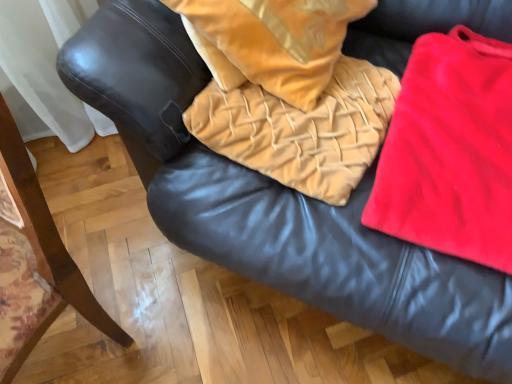
Locate an element on the screen. The width and height of the screenshot is (512, 384). velvet tan blanket at center is located at coordinates (302, 129).

What do you see at coordinates (35, 261) in the screenshot? I see `matte black armrest at left` at bounding box center [35, 261].

What do you see at coordinates (271, 42) in the screenshot? The height and width of the screenshot is (384, 512). I see `velvet tan pillow at center` at bounding box center [271, 42].

Describe the element at coordinates (450, 151) in the screenshot. This screenshot has height=384, width=512. I see `red velvet cloth at right` at that location.

Image resolution: width=512 pixels, height=384 pixels. In order to click on velvet tan blanket at center in this screenshot , I will do `click(302, 129)`.

Considering their positions, is velvet tan blanket at center located in front of or behind red velvet cloth at right?

In the image, velvet tan blanket at center appears behind red velvet cloth at right.

Considering the relative sizes of velvet tan blanket at center and red velvet cloth at right in the image provided, is velvet tan blanket at center thinner than red velvet cloth at right?

Yes.

Can you confirm if velvet tan blanket at center is smaller than red velvet cloth at right?

No, velvet tan blanket at center is not smaller than red velvet cloth at right.

How different are the orientations of velvet tan blanket at center and red velvet cloth at right in degrees?

2.83 degrees.

Can you tell me how much red velvet cloth at right and matte black armrest at left differ in facing direction?

There is a 8.31-degree angle between the facing directions of red velvet cloth at right and matte black armrest at left.

From the image's perspective, between red velvet cloth at right and matte black armrest at left, which one is located above?

red velvet cloth at right appears higher in the image.

Can you confirm if red velvet cloth at right is shorter than matte black armrest at left?

Correct, red velvet cloth at right is not as tall as matte black armrest at left.

Does red velvet cloth at right turn towards matte black armrest at left?

No, red velvet cloth at right is not aimed at matte black armrest at left.

Considering the points (286, 79) and (222, 149), which point is in front, point (286, 79) or point (222, 149)?

Point (222, 149)

Could you tell me if velvet tan pillow at center is turned towards velvet tan blanket at center?

Yes, velvet tan pillow at center is aimed at velvet tan blanket at center.

Could red velvet cloth at right be considered to be inside matte black armrest at left?

That's incorrect, red velvet cloth at right is not inside matte black armrest at left.

From the image's perspective, which one is positioned lower, matte black armrest at left or red velvet cloth at right?

matte black armrest at left.

Does matte black armrest at left appear on the left side of red velvet cloth at right?

Indeed, matte black armrest at left is positioned on the left side of red velvet cloth at right.

Does velvet tan blanket at center contain matte black armrest at left?

No, matte black armrest at left is not a part of velvet tan blanket at center.

Between point (208, 134) and point (42, 273), which one is positioned in front?

The point (42, 273) is closer to the camera.

Can you tell me how much velvet tan blanket at center and matte black armrest at left differ in facing direction?

The facing directions of velvet tan blanket at center and matte black armrest at left are 5.49 degrees apart.

From the image's perspective, relative to matte black armrest at left, is velvet tan blanket at center above or below?

velvet tan blanket at center is above matte black armrest at left.

Is velvet tan blanket at center spatially inside velvet tan pillow at center, or outside of it?

velvet tan blanket at center is not inside velvet tan pillow at center, it's outside.

From a real-world perspective, is velvet tan blanket at center positioned above or below velvet tan pillow at center?

From a real-world perspective, velvet tan blanket at center is physically below velvet tan pillow at center.

Which is behind, point (267, 94) or point (269, 84)?

Point (267, 94)

Between velvet tan pillow at center and matte black armrest at left, which one has larger width?

With larger width is matte black armrest at left.

Are velvet tan pillow at center and matte black armrest at left located far from each other?

No, velvet tan pillow at center is not far away from matte black armrest at left.

Is velvet tan pillow at center located outside matte black armrest at left?

Yes, velvet tan pillow at center is not within matte black armrest at left.

The width and height of the screenshot is (512, 384). In order to click on blanket above the red velvet cloth at right (from a real-world perspective) in this screenshot , I will do `click(302, 129)`.

Find the location of a particular element. furniture on the left side of red velvet cloth at right is located at coordinates (35, 261).

From the image, which object appears to be farther from velvet tan blanket at center, matte black armrest at left or velvet tan pillow at center?

The object further to velvet tan blanket at center is matte black armrest at left.

Considering their positions, is red velvet cloth at right positioned further to velvet tan pillow at center than velvet tan blanket at center?

The object further to velvet tan pillow at center is red velvet cloth at right.

Looking at the image, which one is located further to matte black armrest at left, velvet tan blanket at center or velvet tan pillow at center?

Based on the image, velvet tan pillow at center appears to be further to matte black armrest at left.

Based on their spatial positions, is velvet tan pillow at center or red velvet cloth at right further from velvet tan blanket at center?

Based on the image, red velvet cloth at right appears to be further to velvet tan blanket at center.

Which object lies nearer to the anchor point velvet tan blanket at center, red velvet cloth at right or matte black armrest at left?

The object closer to velvet tan blanket at center is red velvet cloth at right.

Based on the photo, from the image, which object appears to be farther from matte black armrest at left, velvet tan blanket at center or red velvet cloth at right?

red velvet cloth at right lies further to matte black armrest at left than the other object.

Considering their positions, is matte black armrest at left positioned closer to red velvet cloth at right than velvet tan pillow at center?

Based on the image, velvet tan pillow at center appears to be nearer to red velvet cloth at right.

Looking at the image, which one is located further to velvet tan pillow at center, matte black armrest at left or red velvet cloth at right?

matte black armrest at left.

The image size is (512, 384). I want to click on blanket between velvet tan pillow at center and red velvet cloth at right in the horizontal direction, so click(302, 129).

Where is `throw pillow between matte black armrest at left and velvet tan blanket at center in the horizontal direction`? Image resolution: width=512 pixels, height=384 pixels. throw pillow between matte black armrest at left and velvet tan blanket at center in the horizontal direction is located at coordinates (271, 42).

In order to click on throw pillow between matte black armrest at left and red velvet cloth at right in the horizontal direction in this screenshot , I will do `click(271, 42)`.

The width and height of the screenshot is (512, 384). Find the location of `blanket between matte black armrest at left and red velvet cloth at right from left to right`. blanket between matte black armrest at left and red velvet cloth at right from left to right is located at coordinates (302, 129).